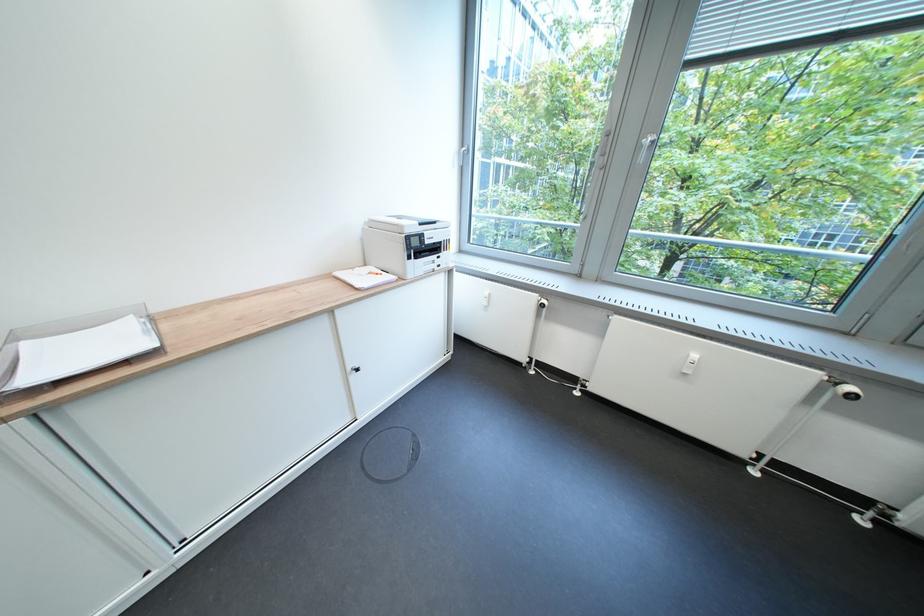
Where is `floor hatch handle`? The width and height of the screenshot is (924, 616). floor hatch handle is located at coordinates (414, 448).